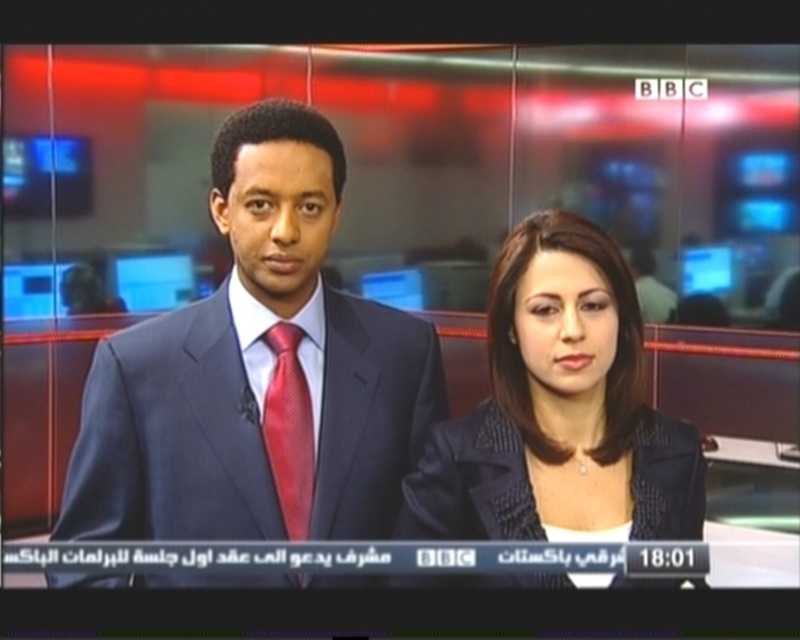
Question: Does matte black blazer at center lie behind shiny silk tie at center?

Choices:
 (A) yes
 (B) no

Answer: (B)

Question: Which point is closer to the camera?

Choices:
 (A) (284, 508)
 (B) (578, 376)

Answer: (B)

Question: Which point appears farthest from the camera in this image?

Choices:
 (A) (500, 260)
 (B) (300, 408)
 (C) (237, 152)

Answer: (A)

Question: Which object appears closest to the camera in this image?

Choices:
 (A) shiny silk tie at center
 (B) matte black blazer at center
 (C) matte black suit at center

Answer: (C)

Question: Is matte black suit at center to the left of matte black blazer at center from the viewer's perspective?

Choices:
 (A) yes
 (B) no

Answer: (A)

Question: In this image, where is matte black suit at center located relative to shiny silk tie at center?

Choices:
 (A) below
 (B) above

Answer: (B)